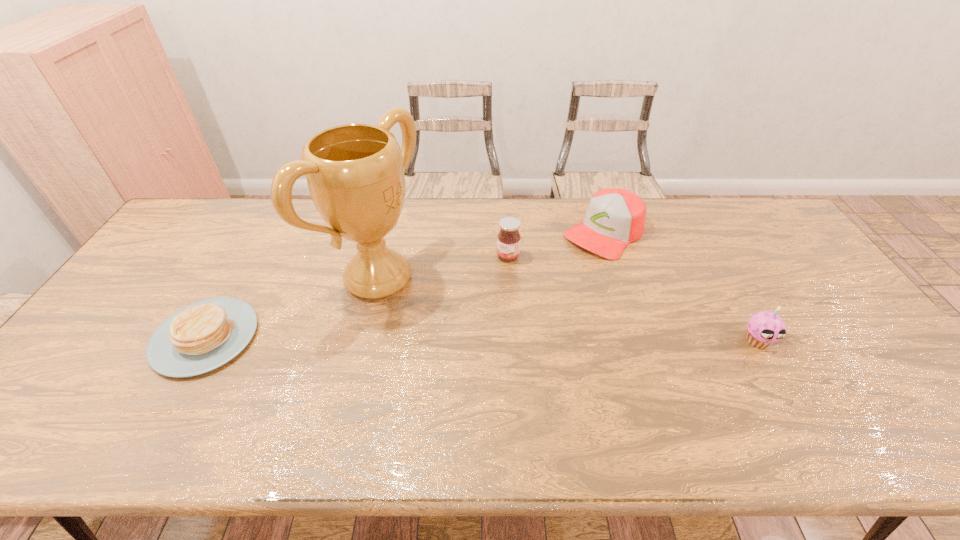
Locate an element on the screen. the shortest object is located at coordinates (205, 335).

Locate an element on the screen. This screenshot has width=960, height=540. pancake is located at coordinates (205, 335).

I want to click on the rightmost object, so click(x=764, y=328).

This screenshot has height=540, width=960. I want to click on baseball cap, so click(x=615, y=217).

Where is `award`? Image resolution: width=960 pixels, height=540 pixels. award is located at coordinates (355, 172).

Locate an element on the screen. The image size is (960, 540). the tallest object is located at coordinates (355, 172).

You are a GUI agent. You are given a task and a screenshot of the screen. Output one action in this format:
    pyautogui.click(x=<x>, y=<y>)
    Task: Click on the third object from left to right
    The image size is (960, 540).
    Given the screenshot: What is the action you would take?
    pyautogui.click(x=508, y=239)

At what (x,y) coordinates should I click in order to perform the action: click on free space located 0.190m on the back of the pancake. Please return your answer as a coordinate pair (x, y). The width and height of the screenshot is (960, 540). Looking at the image, I should click on (252, 256).

Where is `vacant position located 0.080m on the face of the cupcake`? The image size is (960, 540). vacant position located 0.080m on the face of the cupcake is located at coordinates (780, 380).

The width and height of the screenshot is (960, 540). I want to click on vacant space situated on the front-facing side of the baseball cap, so click(519, 309).